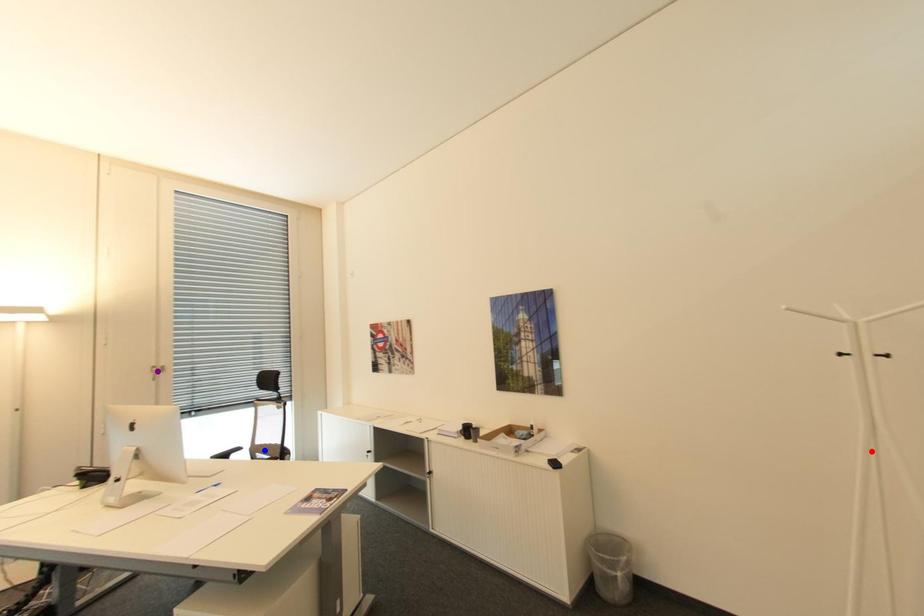
Order these from nearest to farthest:
red point, blue point, purple point

red point < blue point < purple point